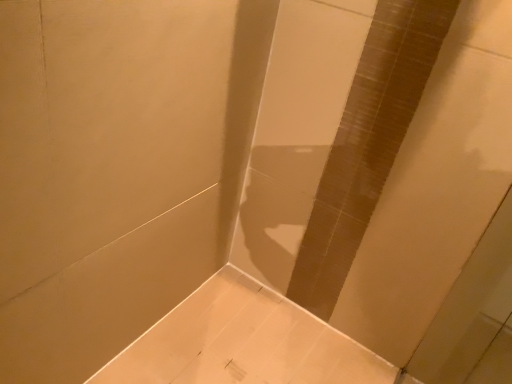
What do you see at coordinates (243, 343) in the screenshot?
I see `white glossy bathtub at lower center` at bounding box center [243, 343].

At what (x,y) coordinates should I click in order to perform the action: click on white glossy bathtub at lower center. Please return your answer as a coordinate pair (x, y). This screenshot has height=384, width=512. Looking at the image, I should click on (243, 343).

This screenshot has width=512, height=384. Identify the location of white glossy bathtub at lower center. (243, 343).